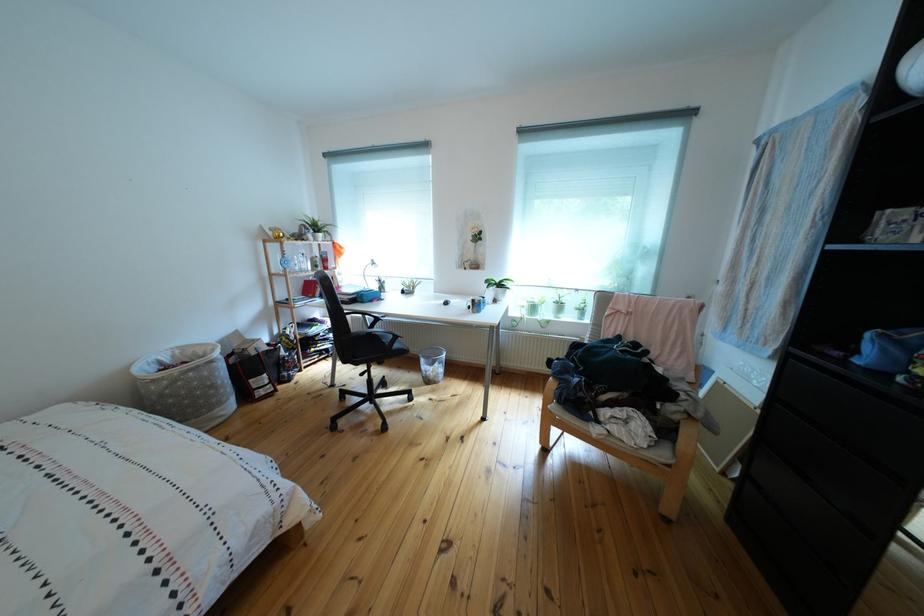
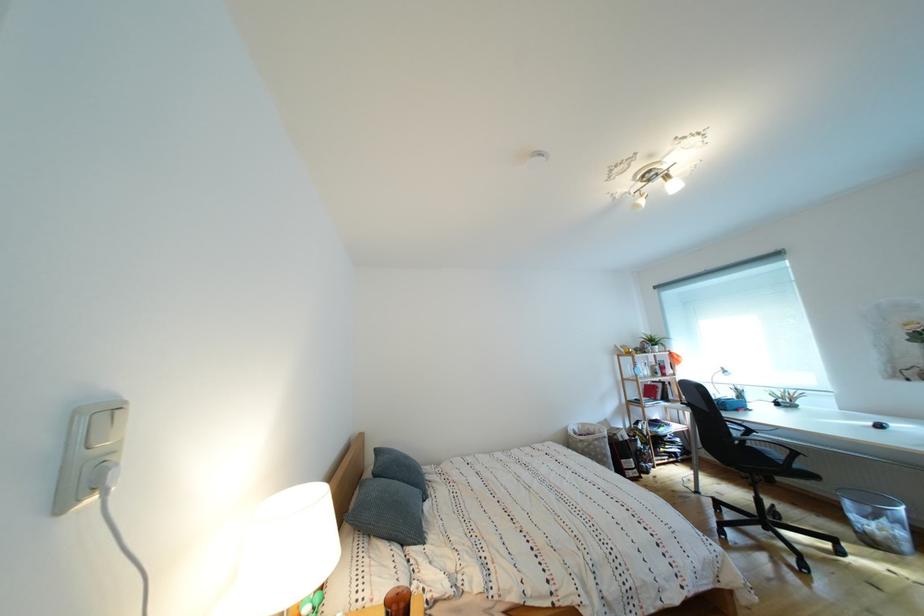
Where in the second image is the point corresponding to [447,370] from the first image?

(896, 527)